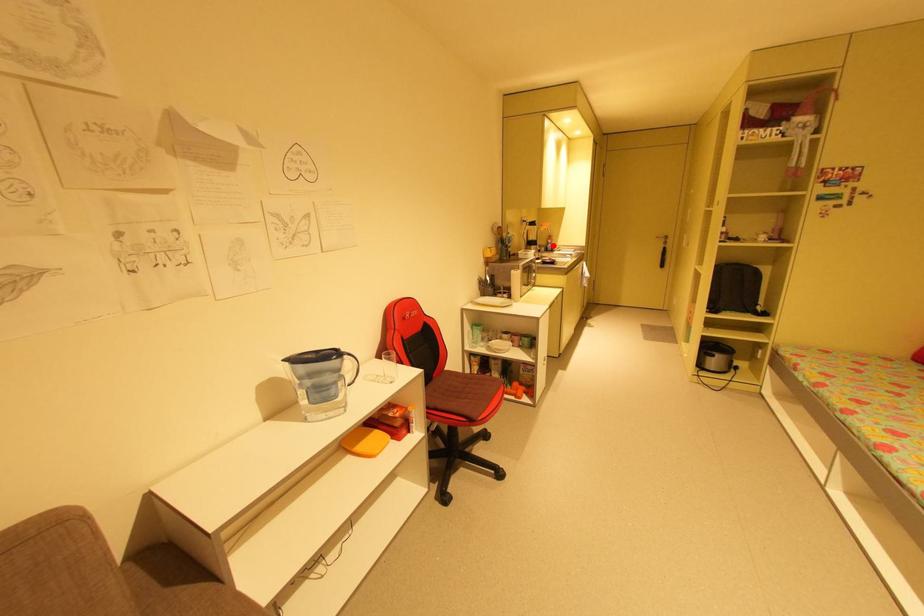
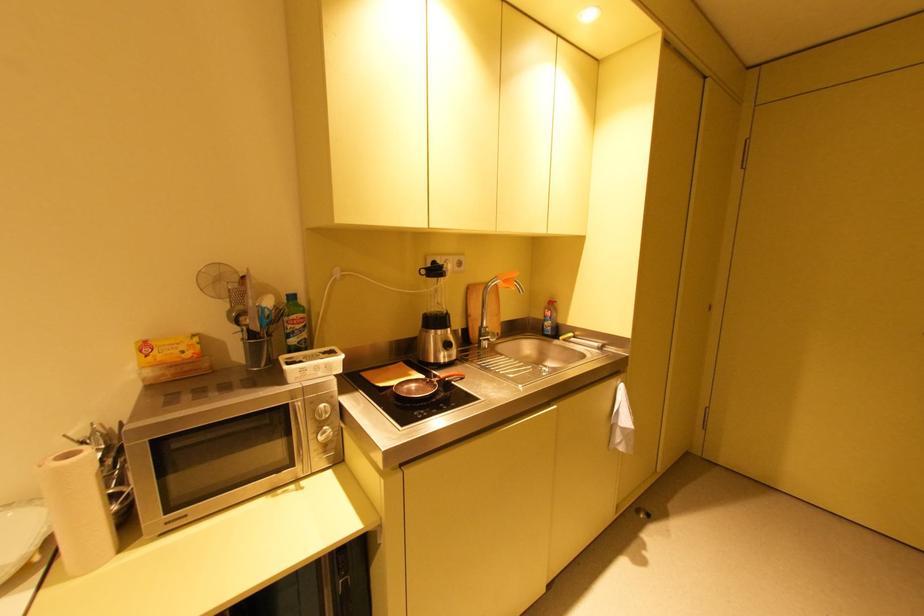
In the second image, find the point that corresponds to the highlighted location in the first image.

(551, 323)